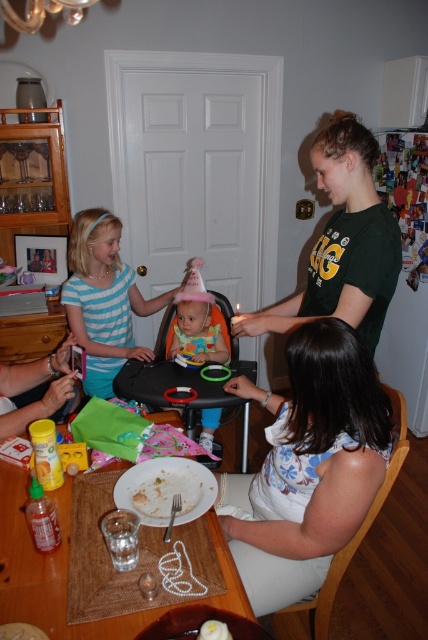
Question: Which object appears farthest from the camera in this image?

Choices:
 (A) striped fabric dress at center
 (B) white matte plate at lower center
 (C) black plastic feeding chair at center

Answer: (A)

Question: Which of these objects is positioned farthest from the white ceramic plate at lower center?

Choices:
 (A) striped fabric dress at center
 (B) black plastic feeding chair at center

Answer: (A)

Question: Considering the relative positions of striped fabric dress at center and black plastic feeding chair at center in the image provided, where is striped fabric dress at center located with respect to black plastic feeding chair at center?

Choices:
 (A) right
 (B) left

Answer: (B)

Question: Can you confirm if green cotton shirt at upper right is smaller than white ceramic plate at lower center?

Choices:
 (A) no
 (B) yes

Answer: (A)

Question: Which point is farther to the camera?

Choices:
 (A) matte pink party hat at center
 (B) white matte plate at lower center
 (C) white ceramic plate at lower center
 (D) green cotton shirt at upper right

Answer: (A)

Question: Is white ceramic plate at lower center smaller than black plastic feeding chair at center?

Choices:
 (A) no
 (B) yes

Answer: (B)